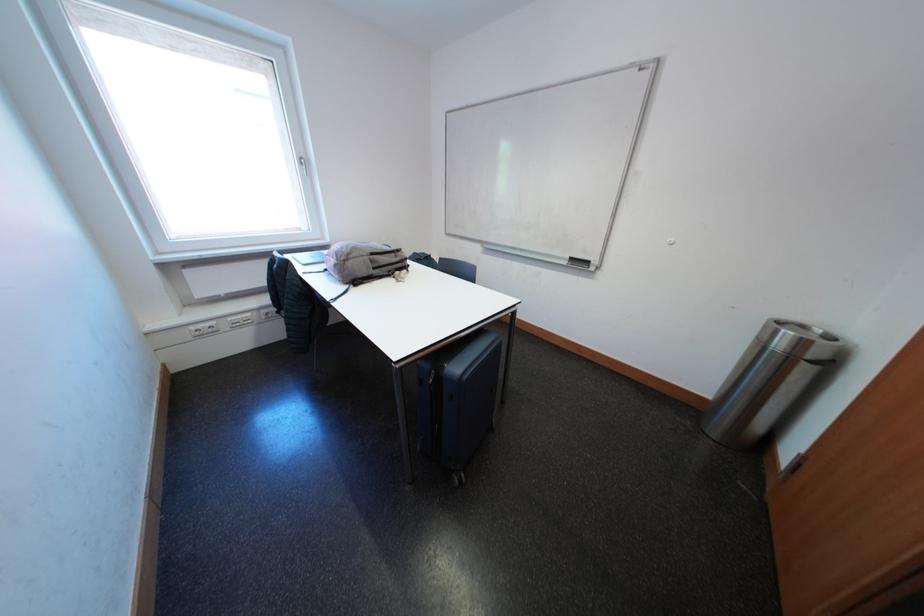
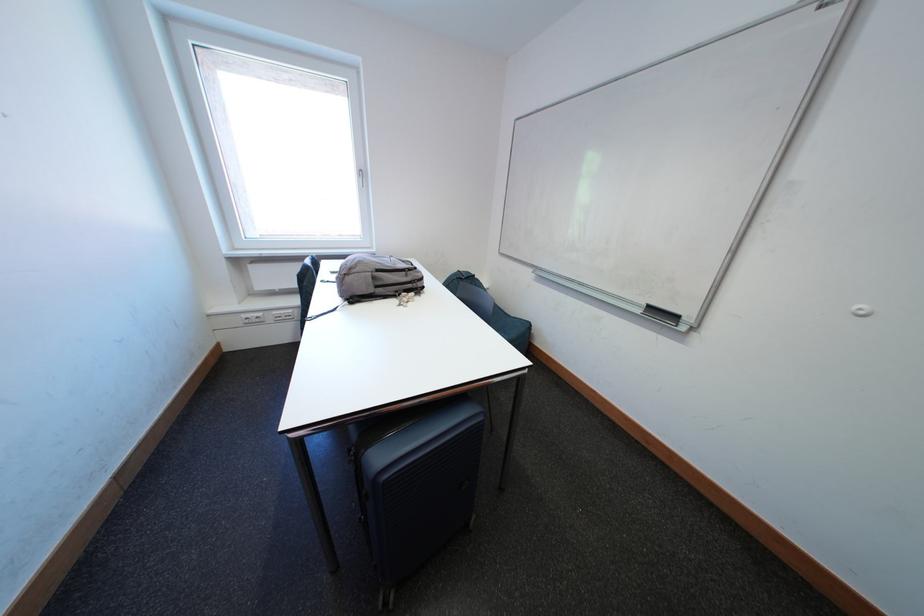
Locate, in the second image, the point that corresponds to point 575,267 in the first image.

(649, 315)